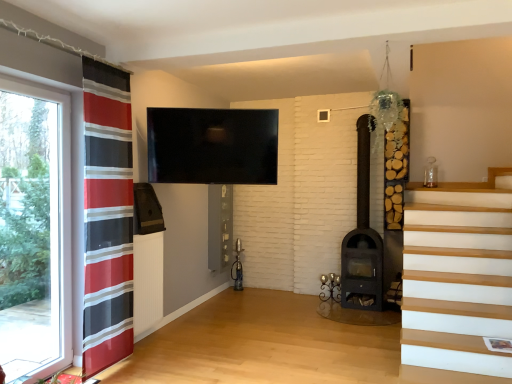
Image resolution: width=512 pixels, height=384 pixels. In order to click on dark brown wood-burning stove at center-right in this screenshot , I will do `click(362, 237)`.

This screenshot has width=512, height=384. Describe the element at coordinates (362, 237) in the screenshot. I see `dark brown wood-burning stove at center-right` at that location.

What do you see at coordinates (34, 230) in the screenshot?
I see `transparent glass window at left` at bounding box center [34, 230].

Locate an element on the screen. The image size is (512, 384). dark brown wood-burning stove at center-right is located at coordinates (362, 237).

From the image's perspective, is red striped curtain at left located above or below dark brown wood-burning stove at center-right?

red striped curtain at left is below dark brown wood-burning stove at center-right.

In the image, is red striped curtain at left positioned in front of or behind dark brown wood-burning stove at center-right?

Visually, red striped curtain at left is located in front of dark brown wood-burning stove at center-right.

Locate an element on the screen. Image resolution: width=512 pixels, height=384 pixels. curtain above the dark brown wood-burning stove at center-right (from a real-world perspective) is located at coordinates (106, 217).

Can you confirm if red striped curtain at left is shorter than dark brown wood-burning stove at center-right?

Incorrect, the height of red striped curtain at left does not fall short of that of dark brown wood-burning stove at center-right.

Is transparent glass window at left outside of red striped curtain at left?

Yes, transparent glass window at left is outside of red striped curtain at left.

Is point (22, 106) closer to viewer compared to point (84, 60)?

No.

How much distance is there between transparent glass window at left and red striped curtain at left?

transparent glass window at left is 22.28 inches away from red striped curtain at left.

Which is more to the right, transparent glass window at left or red striped curtain at left?

From the viewer's perspective, red striped curtain at left appears more on the right side.

How different are the orientations of red striped curtain at left and transparent glass window at left in degrees?

1.91 degrees separate the facing orientations of red striped curtain at left and transparent glass window at left.

Which object is positioned more to the right, red striped curtain at left or transparent glass window at left?

Positioned to the right is red striped curtain at left.

From a real-world perspective, is red striped curtain at left positioned above or below transparent glass window at left?

Clearly, from a real-world perspective, red striped curtain at left is above transparent glass window at left.

Is red striped curtain at left in contact with transparent glass window at left?

No, red striped curtain at left is not next to transparent glass window at left.

Could you measure the distance between transparent glass window at left and dark brown wood-burning stove at center-right?

transparent glass window at left and dark brown wood-burning stove at center-right are 11.15 feet apart.

Considering the positions of objects transparent glass window at left and dark brown wood-burning stove at center-right in the image provided, who is more to the left, transparent glass window at left or dark brown wood-burning stove at center-right?

transparent glass window at left.

Could you tell me if transparent glass window at left is turned towards dark brown wood-burning stove at center-right?

No, transparent glass window at left is not turned towards dark brown wood-burning stove at center-right.

Considering the sizes of objects transparent glass window at left and dark brown wood-burning stove at center-right in the image provided, who is taller, transparent glass window at left or dark brown wood-burning stove at center-right?

dark brown wood-burning stove at center-right is taller.

Are dark brown wood-burning stove at center-right and red striped curtain at left located far from each other?

Yes, dark brown wood-burning stove at center-right and red striped curtain at left are located far from each other.

From a real-world perspective, which object stands above the other?

red striped curtain at left, from a real-world perspective.

Does point (360, 136) come closer to viewer compared to point (124, 129)?

That is False.

Would you say dark brown wood-burning stove at center-right is to the left or to the right of red striped curtain at left in the picture?

From the image, it's evident that dark brown wood-burning stove at center-right is to the right of red striped curtain at left.

Who is smaller, dark brown wood-burning stove at center-right or transparent glass window at left?

transparent glass window at left is smaller.

Between dark brown wood-burning stove at center-right and transparent glass window at left, which one is positioned in front?

transparent glass window at left is more forward.

Based on their positions, is dark brown wood-burning stove at center-right located to the left or right of transparent glass window at left?

dark brown wood-burning stove at center-right is positioned on transparent glass window at left's right side.

This screenshot has width=512, height=384. I want to click on curtain that appears below the dark brown wood-burning stove at center-right (from the image's perspective), so click(106, 217).

Locate an element on the screen. This screenshot has width=512, height=384. window below the red striped curtain at left (from a real-world perspective) is located at coordinates (34, 230).

In the scene shown: Which object lies nearer to the anchor point transparent glass window at left, dark brown wood-burning stove at center-right or red striped curtain at left?

Based on the image, red striped curtain at left appears to be nearer to transparent glass window at left.

Based on their spatial positions, is red striped curtain at left or dark brown wood-burning stove at center-right closer to transparent glass window at left?

red striped curtain at left.

Which object lies nearer to the anchor point dark brown wood-burning stove at center-right, red striped curtain at left or transparent glass window at left?

Based on the image, red striped curtain at left appears to be nearer to dark brown wood-burning stove at center-right.

From the image, which object appears to be farther from red striped curtain at left, transparent glass window at left or dark brown wood-burning stove at center-right?

dark brown wood-burning stove at center-right is positioned further to the anchor red striped curtain at left.

Looking at the image, which one is located further to dark brown wood-burning stove at center-right, transparent glass window at left or red striped curtain at left?

transparent glass window at left is further to dark brown wood-burning stove at center-right.

Estimate the real-world distances between objects in this image. Which object is further from red striped curtain at left, dark brown wood-burning stove at center-right or transparent glass window at left?

dark brown wood-burning stove at center-right.

What are the coordinates of `curtain located between transparent glass window at left and dark brown wood-burning stove at center-right in the left-right direction` in the screenshot? It's located at (106, 217).